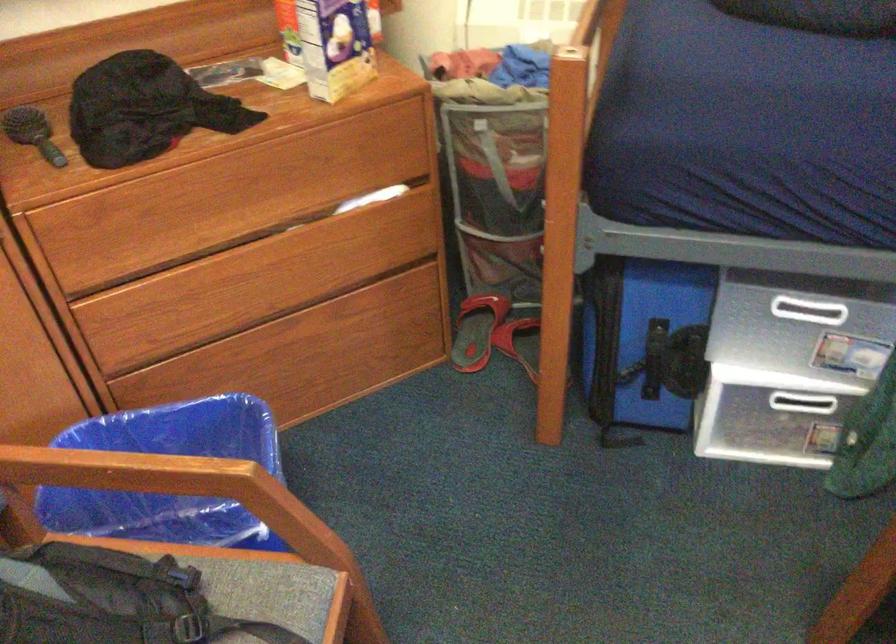
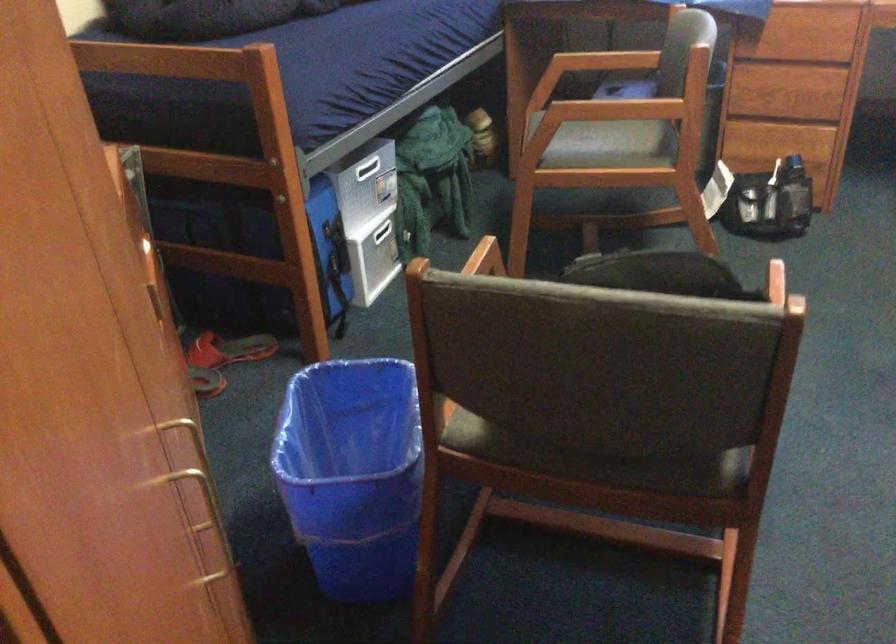
Where in the second image is the point corresponding to (x=247, y=514) from the first image?

(487, 257)